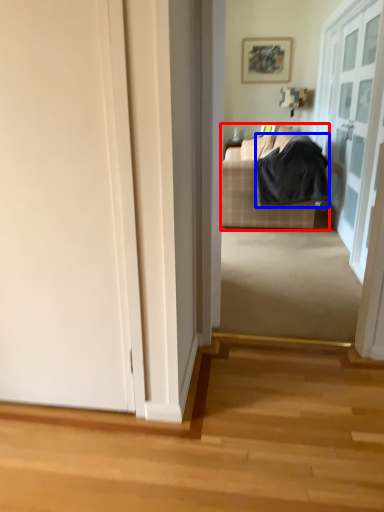
Question: Which of the following is the closest to the observer, studio couch (highlighted by a red box) or blanket (highlighted by a blue box)?

Choices:
 (A) studio couch
 (B) blanket

Answer: (B)